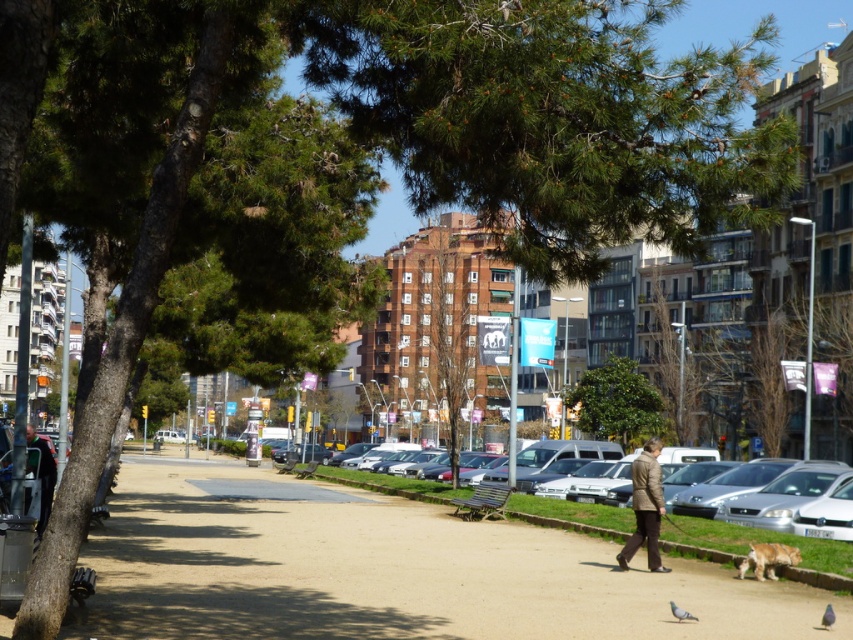
Between silver metallic sedan at center and gray matte pigeon at lower center, which one is positioned lower?

silver metallic sedan at center is below.

Between silver metallic sedan at center and gray matte pigeon at lower center, which one appears on the left side from the viewer's perspective?

Positioned to the left is silver metallic sedan at center.

From the picture: Measure the distance between silver metallic sedan at center and camera.

The distance of silver metallic sedan at center from camera is 62.95 feet.

This screenshot has height=640, width=853. Find the location of `silver metallic sedan at center`. silver metallic sedan at center is located at coordinates (732, 534).

Does golden fur dog at lower right have a lesser height compared to dark brown leather jacket at left?

Yes, golden fur dog at lower right is shorter than dark brown leather jacket at left.

The image size is (853, 640). Describe the element at coordinates (767, 557) in the screenshot. I see `golden fur dog at lower right` at that location.

Measure the distance between point (757, 545) and camera.

They are 60.17 feet apart.

You are a GUI agent. You are given a task and a screenshot of the screen. Output one action in this format:
    pyautogui.click(x=<x>, y=<y>)
    Task: Click on the golden fur dog at lower right
    The width and height of the screenshot is (853, 640).
    Given the screenshot: What is the action you would take?
    pyautogui.click(x=767, y=557)

Which is in front, point (473, 531) or point (770, 561)?

Point (770, 561) is more forward.

Does smooth concrete path at center lie behind golden fur dog at lower right?

No, it is in front of golden fur dog at lower right.

I want to click on smooth concrete path at center, so click(387, 570).